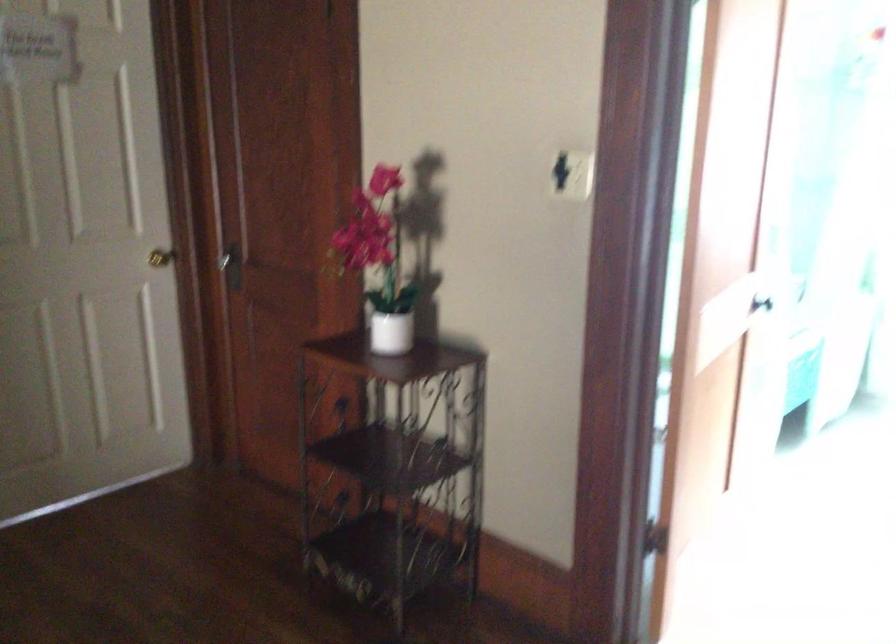
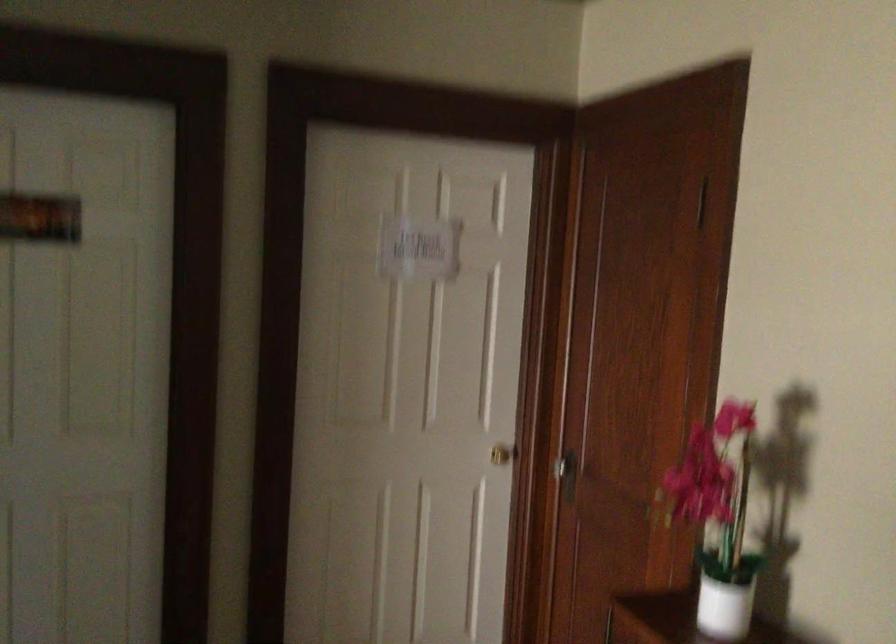
Question: The camera is either moving clockwise (left) or counter-clockwise (right) around the object. The first image is from the beginning of the video and the second image is from the end. Is the camera moving left or right when shooting the video?

Choices:
 (A) Left
 (B) Right

Answer: (B)